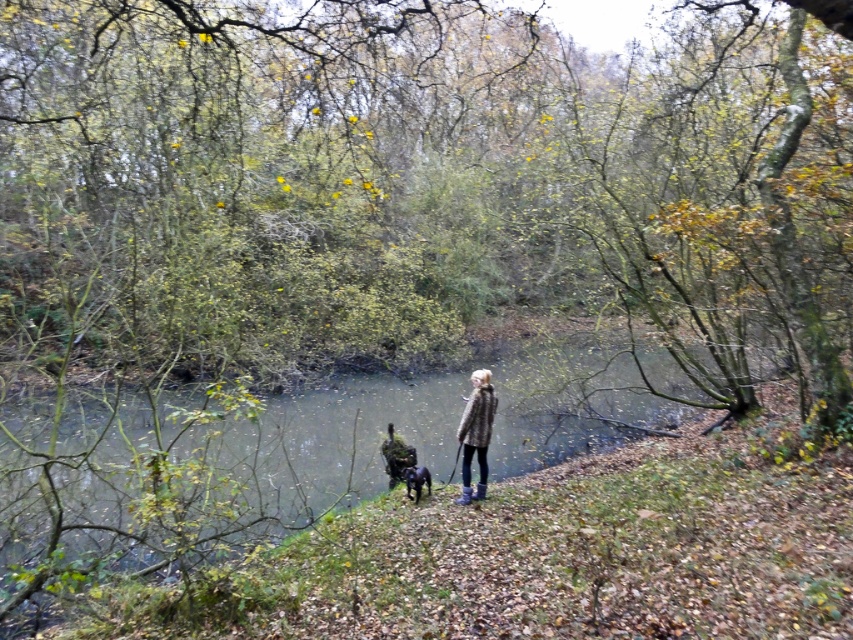
Question: Can you confirm if clear water at center is positioned below fuzzy gray coat at center?

Choices:
 (A) no
 (B) yes

Answer: (B)

Question: Which point is farther to the camera?

Choices:
 (A) clear water at center
 (B) fuzzy gray coat at center

Answer: (B)

Question: Is clear water at center above shiny black dog at center?

Choices:
 (A) no
 (B) yes

Answer: (B)

Question: Which point is farther from the camera taking this photo?

Choices:
 (A) (416, 468)
 (B) (474, 432)

Answer: (A)

Question: In this image, where is clear water at center located relative to shiny black dog at center?

Choices:
 (A) below
 (B) above

Answer: (B)

Question: Which of the following is the farthest from the observer?

Choices:
 (A) (393, 413)
 (B) (479, 486)

Answer: (A)